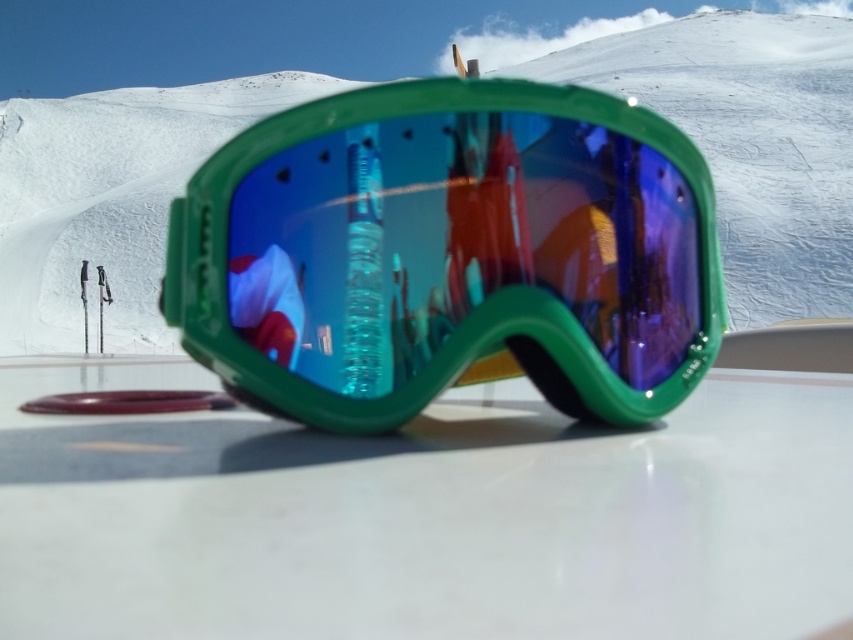
Question: Which point is farther to the camera?

Choices:
 (A) (164, 312)
 (B) (753, 602)

Answer: (A)

Question: Estimate the real-world distances between objects in this image. Which object is farther from the green plastic goggles at center?

Choices:
 (A) white glossy table at center
 (B) white matte snow at center

Answer: (B)

Question: In this image, where is white glossy table at center located relative to green plastic goggles at center?

Choices:
 (A) right
 (B) left

Answer: (B)

Question: Is white glossy table at center above white matte snow at center?

Choices:
 (A) yes
 (B) no

Answer: (B)

Question: Among these objects, which one is farthest from the camera?

Choices:
 (A) white matte snow at center
 (B) white glossy table at center
 (C) green plastic goggles at center

Answer: (A)

Question: Is green plastic goggles at center bigger than white matte snow at center?

Choices:
 (A) yes
 (B) no

Answer: (B)